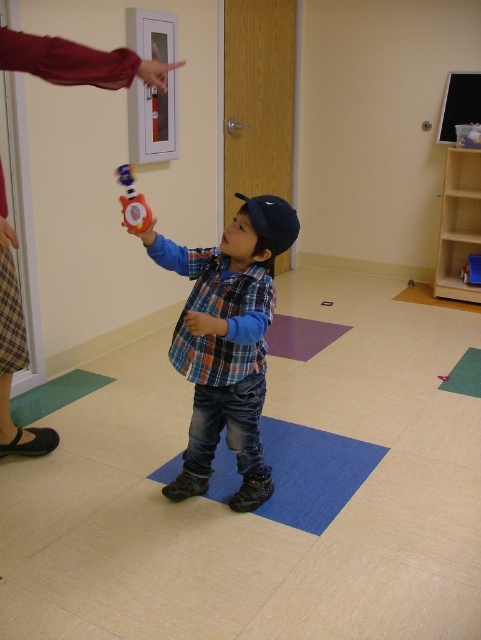
Question: Where is plaid shirt at center located in relation to rubberized red fire extinguisher at center in the image?

Choices:
 (A) above
 (B) below

Answer: (B)

Question: From the image, what is the correct spatial relationship of plaid shirt at center in relation to rubberized red fire extinguisher at center?

Choices:
 (A) above
 (B) below

Answer: (B)

Question: Is plaid shirt at center to the right of rubberized red fire extinguisher at center from the viewer's perspective?

Choices:
 (A) yes
 (B) no

Answer: (A)